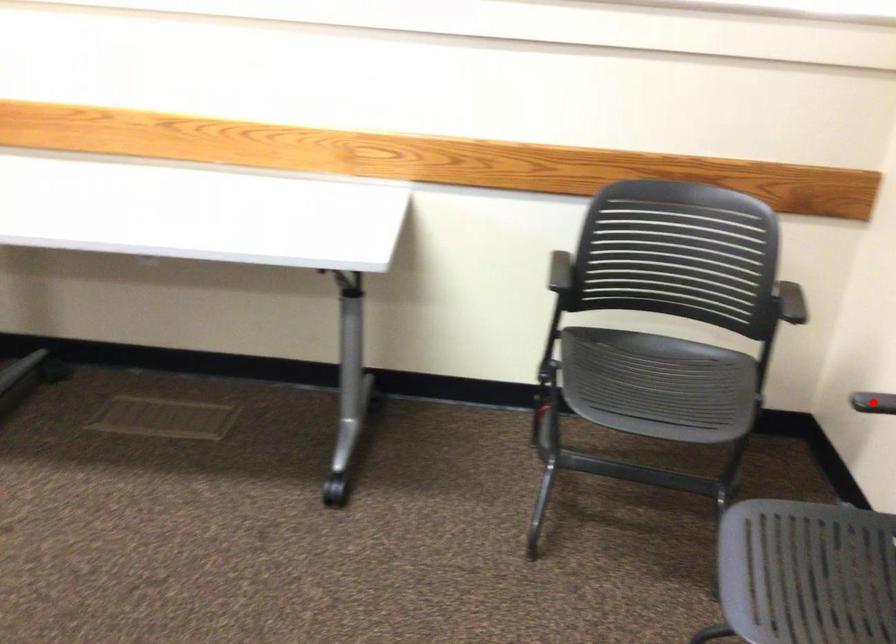
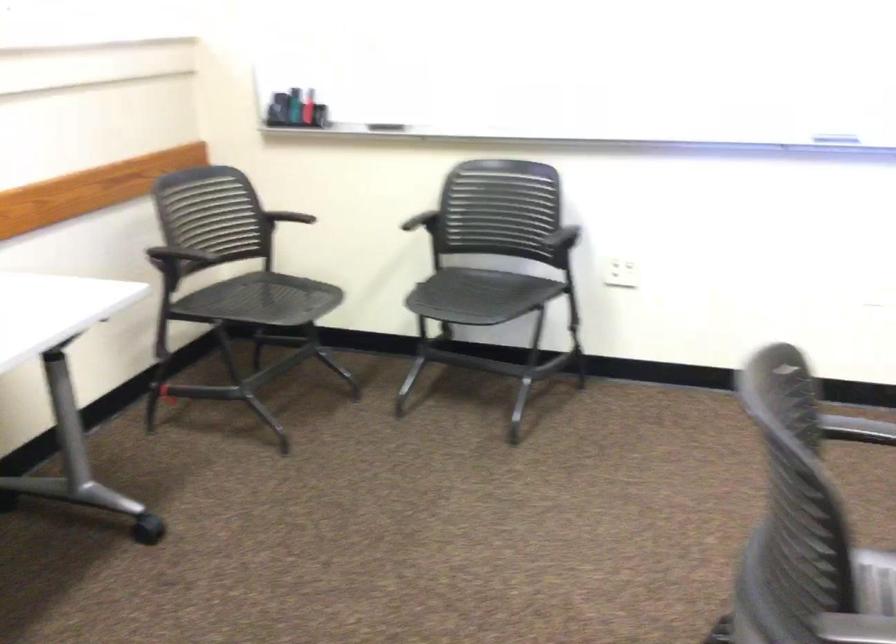
In the second image, find the point that corresponds to the highlighted location in the first image.

(419, 223)